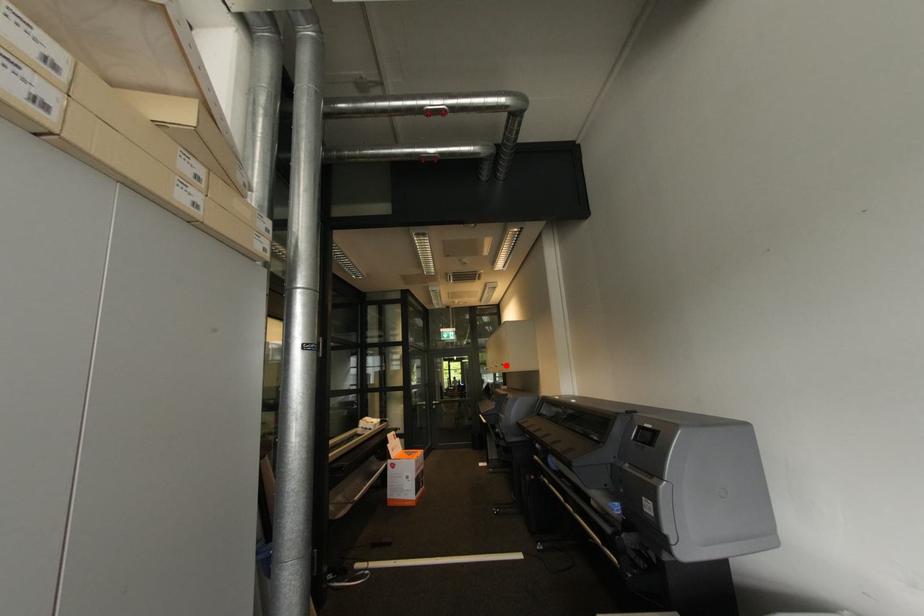
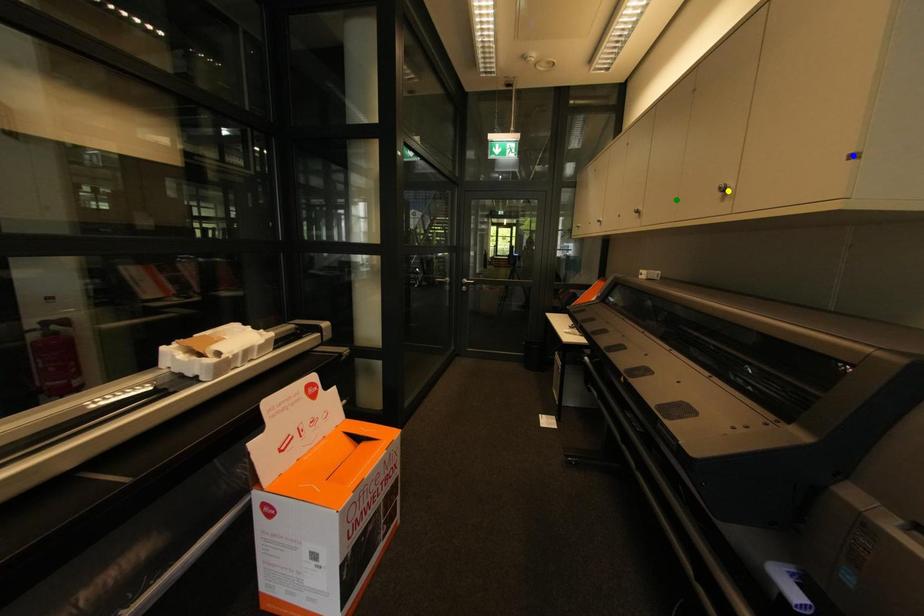
Question: I am providing you with two images of the same scene from different viewpoints. A red point is marked on the first image. You are given multiple points on the second image. Which point in image 2 represents the same 3d spot as the red point in image 1?

Choices:
 (A) blue point
 (B) yellow point
 (C) green point

Answer: (B)